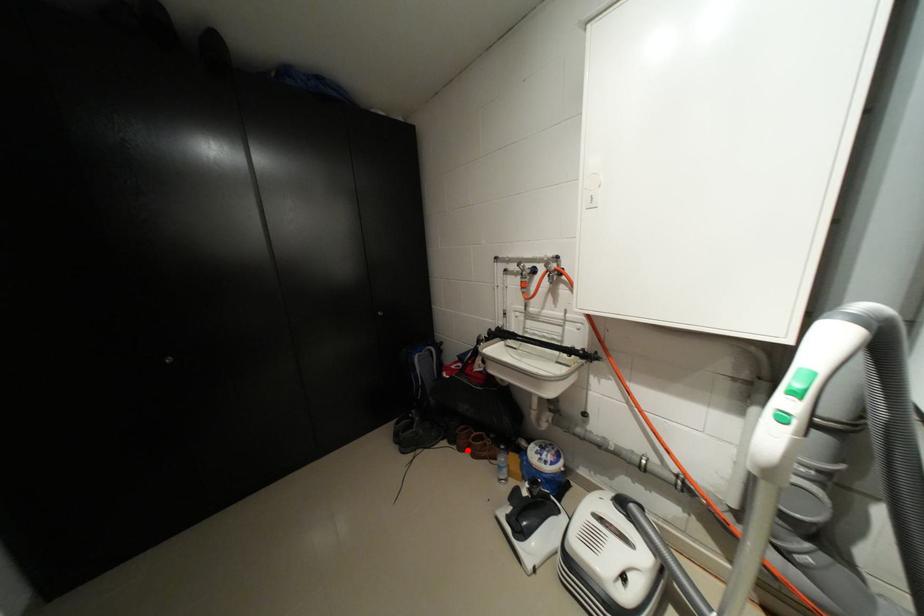
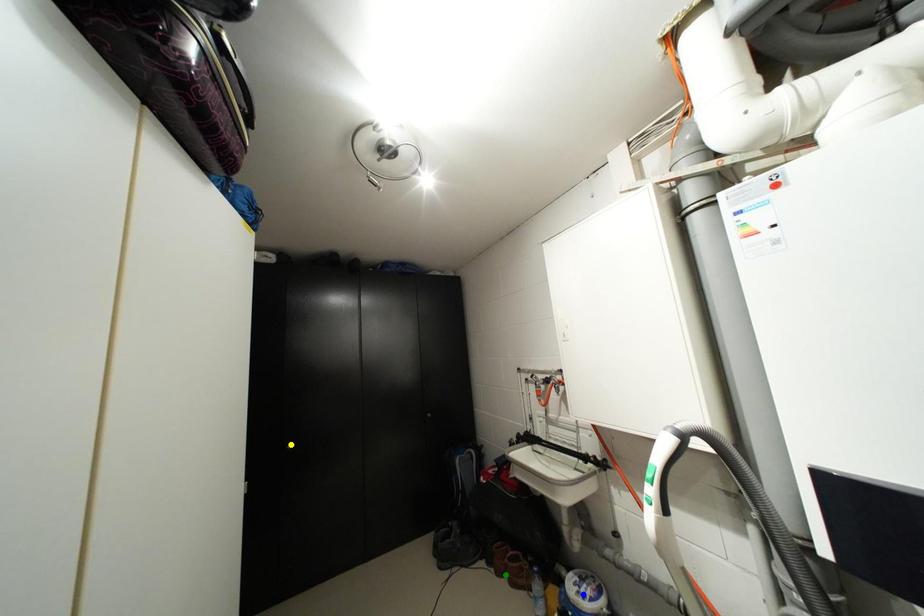
Question: I am providing you with two images of the same scene from different viewpoints. A red point is marked on the first image. You are given multiple points on the second image. In image 2, which mark is for the same physical point as the one in image 1?

Choices:
 (A) green point
 (B) blue point
 (C) yellow point

Answer: (A)